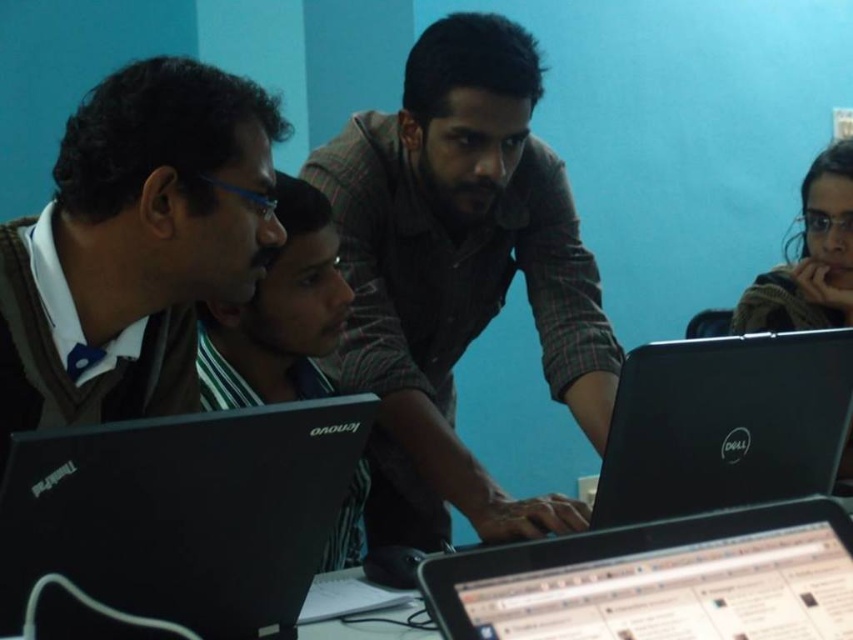
You are organizing a small event and need to place a 12 inch wide decorative plate between the plaid shirt at center and the black glossy laptop at center. Based on their widths, can the plate fit between them without overlapping either object?

The plaid shirt at center might be wider than black glossy laptop at center, so the plate may not fit between them without overlapping since the combined width of both objects could exceed the space available.

You are organizing a tech event and need to stack these two black matte laptops. The black matte laptop at lower left and the black matte laptop at right are both available. Which one should you choose if you want the taller stack?

The black matte laptop at lower left has a greater height compared to the black matte laptop at right, so choosing the black matte laptop at lower left will result in a taller stack.